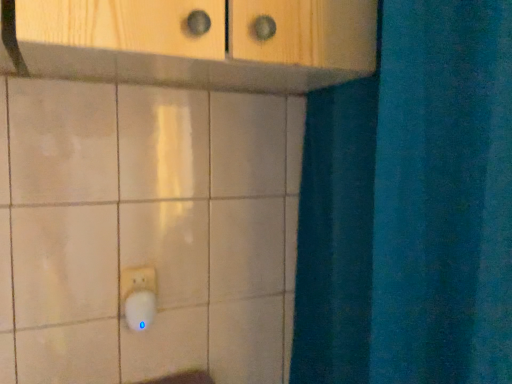
Describe the element at coordinates (140, 309) in the screenshot. The height and width of the screenshot is (384, 512). I see `white plastic knob at lower left` at that location.

You are a GUI agent. You are given a task and a screenshot of the screen. Output one action in this format:
    pyautogui.click(x=<x>, y=<y>)
    Task: Click on the white plastic knob at lower left
    This screenshot has height=384, width=512.
    Given the screenshot: What is the action you would take?
    pyautogui.click(x=140, y=309)

The image size is (512, 384). Describe the element at coordinates (137, 281) in the screenshot. I see `white plastic light switch at lower left` at that location.

You are a GUI agent. You are given a task and a screenshot of the screen. Output one action in this format:
    pyautogui.click(x=<x>, y=<y>)
    Task: Click on the white plastic light switch at lower left
    The height and width of the screenshot is (384, 512).
    Given the screenshot: What is the action you would take?
    click(x=137, y=281)

What is the approximate height of white plastic light switch at lower left?

The height of white plastic light switch at lower left is 3.94 inches.

I want to click on white plastic knob at lower left, so click(140, 309).

In the image, is white plastic knob at lower left on the left side or the right side of white plastic light switch at lower left?

In the image, white plastic knob at lower left appears on the right side of white plastic light switch at lower left.

Between white plastic knob at lower left and white plastic light switch at lower left, which one is positioned behind?

white plastic light switch at lower left is further from the camera.

Does point (142, 318) lie in front of point (124, 280)?

Yes, it is.

From the image's perspective, between white plastic knob at lower left and white plastic light switch at lower left, who is located below?

white plastic knob at lower left.

From a real-world perspective, is white plastic knob at lower left located beneath white plastic light switch at lower left?

Yes, from a real-world perspective, white plastic knob at lower left is below white plastic light switch at lower left.

In terms of width, does white plastic knob at lower left look wider or thinner when compared to white plastic light switch at lower left?

Considering their sizes, white plastic knob at lower left looks broader than white plastic light switch at lower left.

In terms of height, does white plastic knob at lower left look taller or shorter compared to white plastic light switch at lower left?

Considering their sizes, white plastic knob at lower left has less height than white plastic light switch at lower left.

Is white plastic knob at lower left bigger than white plastic light switch at lower left?

Yes, white plastic knob at lower left is bigger than white plastic light switch at lower left.

Is white plastic knob at lower left completely or partially outside of white plastic light switch at lower left?

Absolutely, white plastic knob at lower left is external to white plastic light switch at lower left.

Is white plastic knob at lower left with white plastic light switch at lower left?

Yes, white plastic knob at lower left is in contact with white plastic light switch at lower left.

Is white plastic light switch at lower left at the back of white plastic knob at lower left?

Yes, white plastic knob at lower left is positioned with its back facing white plastic light switch at lower left.

How different are the orientations of white plastic knob at lower left and white plastic light switch at lower left in degrees?

3.7 degrees separate the facing orientations of white plastic knob at lower left and white plastic light switch at lower left.

Measure the distance from white plastic knob at lower left to white plastic light switch at lower left.

white plastic knob at lower left is 1.30 inches from white plastic light switch at lower left.

At what (x,y) coordinates should I click in order to perform the action: click on light switch above the white plastic knob at lower left (from a real-world perspective). Please return your answer as a coordinate pair (x, y). This screenshot has height=384, width=512. Looking at the image, I should click on (137, 281).

Visually, is white plastic light switch at lower left positioned to the left or to the right of white plastic knob at lower left?

From the image, it's evident that white plastic light switch at lower left is to the left of white plastic knob at lower left.

Is white plastic light switch at lower left in front of or behind white plastic knob at lower left in the image?

Clearly, white plastic light switch at lower left is behind white plastic knob at lower left.

Between point (142, 266) and point (143, 299), which one is positioned behind?

The point (142, 266) is behind.

From the image's perspective, between white plastic light switch at lower left and white plastic knob at lower left, who is located below?

white plastic knob at lower left is shown below in the image.

From a real-world perspective, is white plastic light switch at lower left positioned above or below white plastic knob at lower left?

In terms of real-world spatial position, white plastic light switch at lower left is above white plastic knob at lower left.

Is white plastic light switch at lower left wider than white plastic knob at lower left?

Incorrect, the width of white plastic light switch at lower left does not surpass that of white plastic knob at lower left.

Between white plastic light switch at lower left and white plastic knob at lower left, which one has less height?

Standing shorter between the two is white plastic knob at lower left.

Between white plastic light switch at lower left and white plastic knob at lower left, which one has smaller size?

white plastic light switch at lower left is smaller.

From the picture: Is white plastic light switch at lower left outside of white plastic knob at lower left?

Absolutely, white plastic light switch at lower left is external to white plastic knob at lower left.

Is white plastic light switch at lower left touching white plastic knob at lower left?

Yes, white plastic light switch at lower left is next to white plastic knob at lower left.

Is white plastic light switch at lower left aimed at white plastic knob at lower left?

Yes.

What's the angular difference between white plastic light switch at lower left and white plastic knob at lower left's facing directions?

The angle between the facing direction of white plastic light switch at lower left and the facing direction of white plastic knob at lower left is 3.7 degrees.

Identify the location of knob in front of the white plastic light switch at lower left. The width and height of the screenshot is (512, 384). (140, 309).

The height and width of the screenshot is (384, 512). Identify the location of light switch that is on the left side of white plastic knob at lower left. (137, 281).

This screenshot has height=384, width=512. Find the location of `knob that appears on the right of white plastic light switch at lower left`. knob that appears on the right of white plastic light switch at lower left is located at coordinates (140, 309).